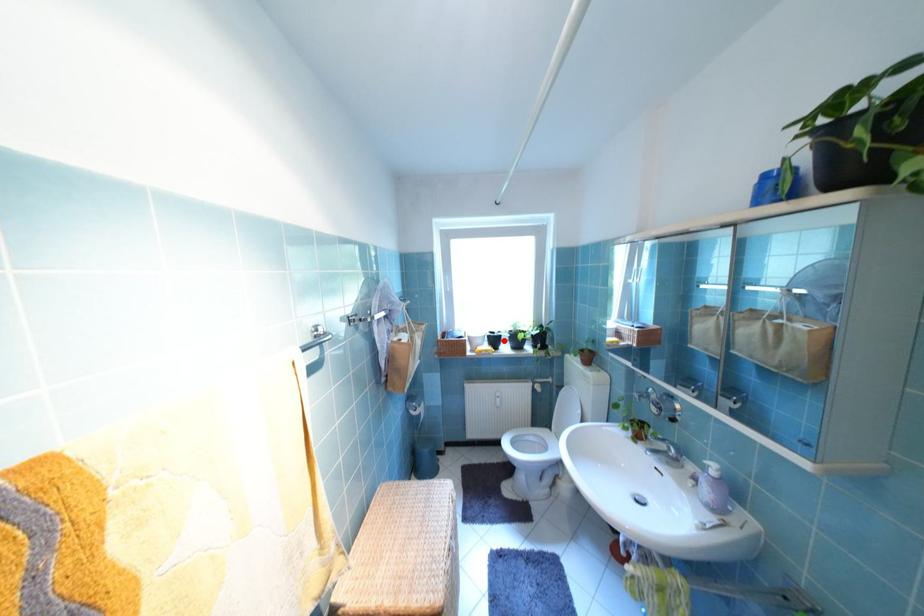
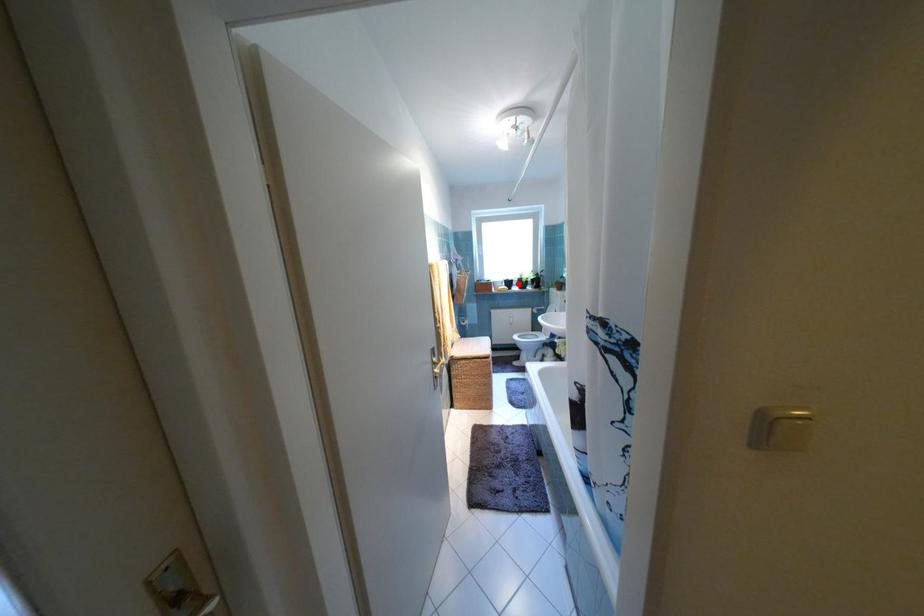
I am providing you with two images of the same scene from different viewpoints. A red point is marked on the first image and another point is marked on the second image. Is the marked point in image1 the same physical position as the marked point in image2?

Yes